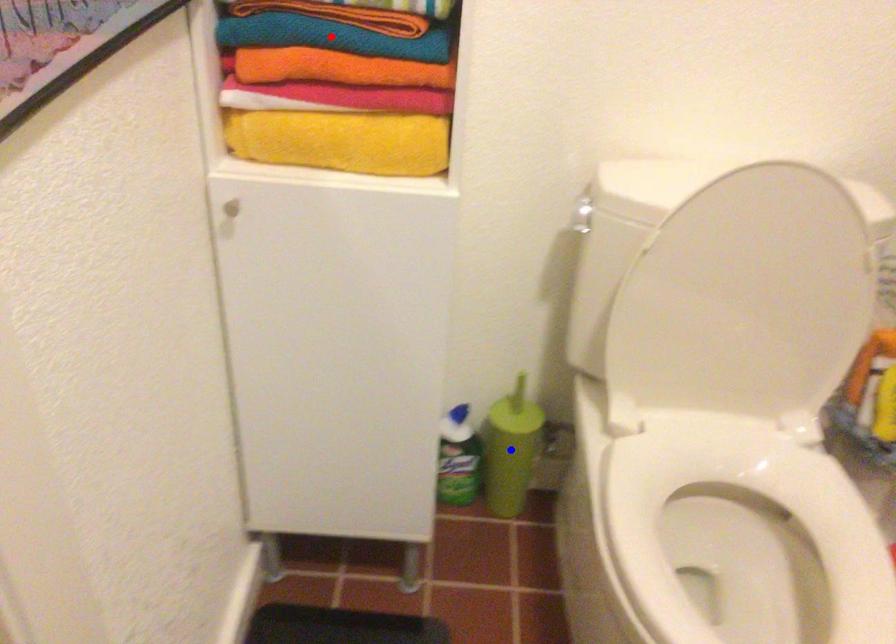
Question: Which of the two points in the image is closer to the camera?

Choices:
 (A) Blue point is closer.
 (B) Red point is closer.

Answer: (B)